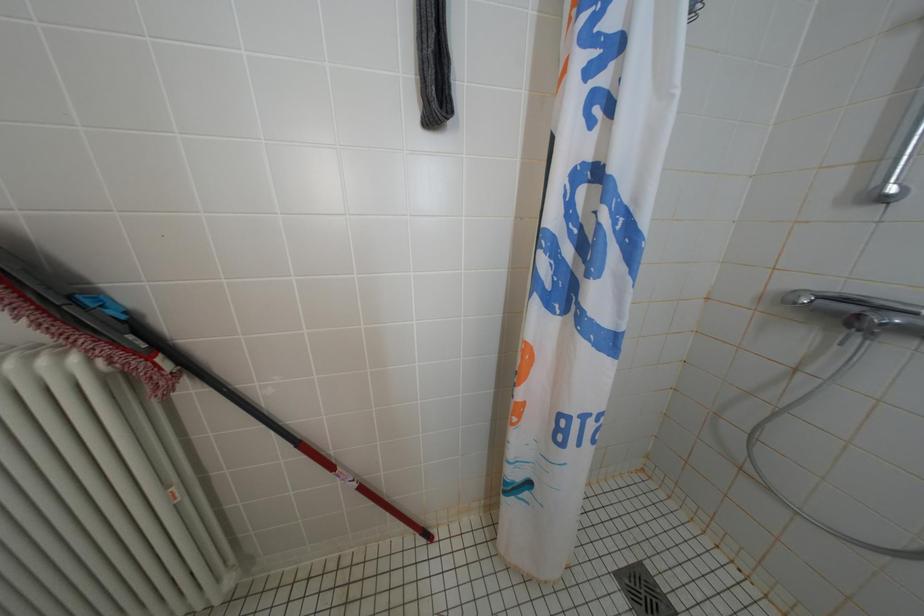
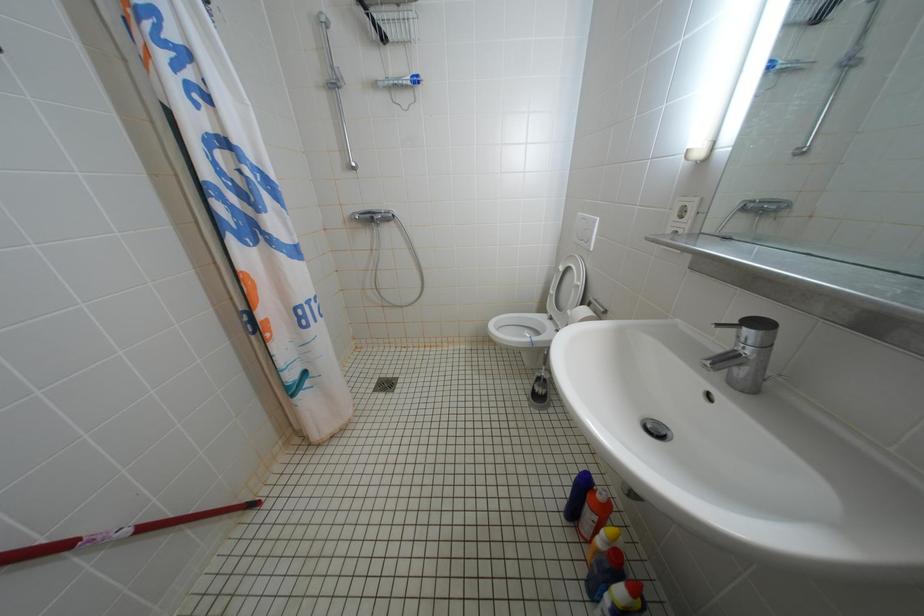
First-person continuous shooting, in which direction is the camera rotating?

The rotation direction of the camera is right-down.